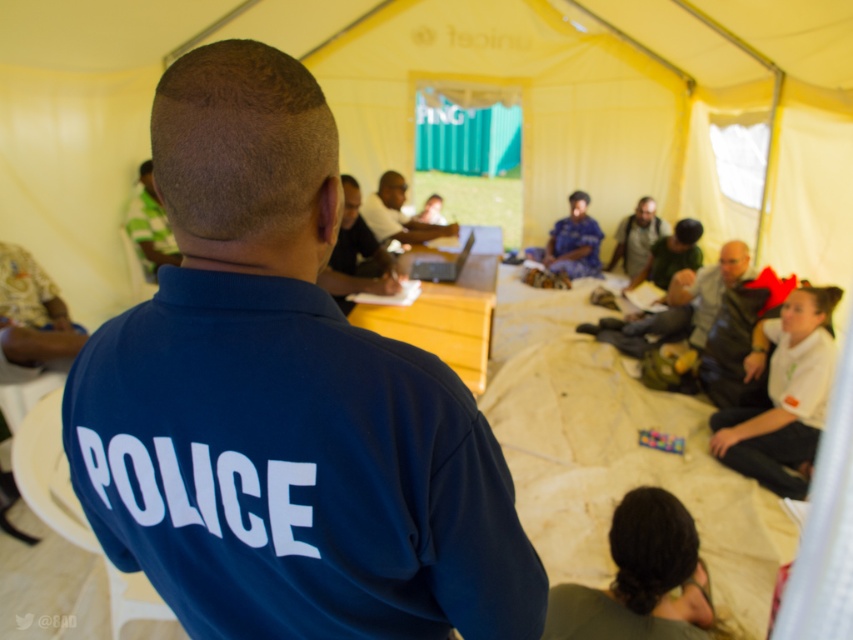
You are standing at the entrance of the tent and see the point marked at coordinate (784,396). What object is located at that point?

The point at coordinate (784,396) indicates the white fabric shirt at lower right.

You are standing at point (444, 275) and want to walk to the entrance of the tent. There is a person in a blue shirt with POLICE written on the back standing at point (723, 432). Can you walk directly to the entrance without passing by the police officer?

Point (723, 432) is in front of point (444, 275), so if you walk directly towards the entrance from point (444, 275), you will pass by the police officer at point (723, 432).

You are a guest at the meeting and need to borrow the matte black laptop at center. The person in the white fabric shirt at lower right is blocking your path. Can you walk around them to reach the laptop?

The white fabric shirt at lower right is in front of the matte black laptop at center, so you can walk around them to reach the laptop since they are blocking the direct path but you can go around.